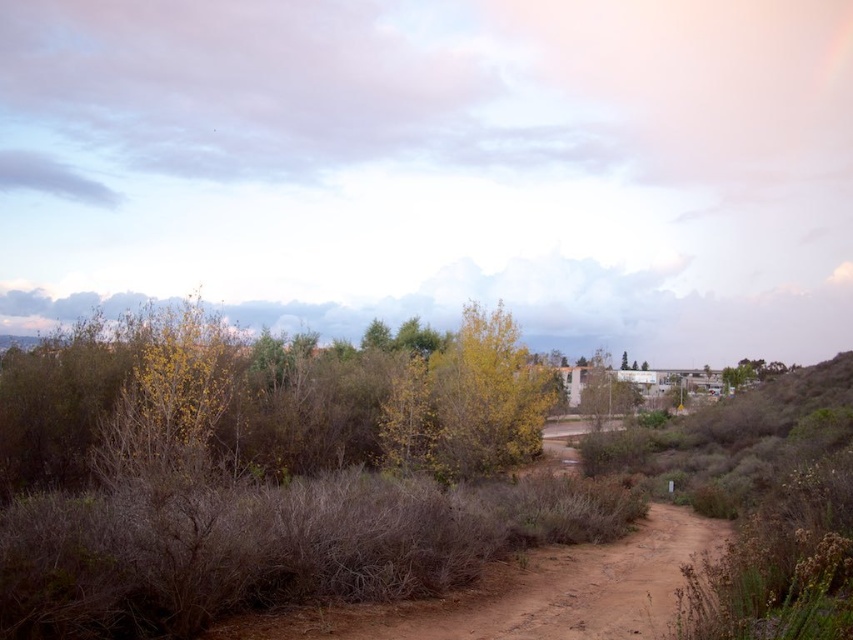
Is point (508, 460) positioned in front of point (751, 378)?

That is True.

Does green leafy bush at left have a larger size compared to green leafy tree at upper right?

Yes.

Who is more distant from viewer, (410,445) or (757,371)?

Positioned behind is point (757,371).

What are the coordinates of `green leafy bush at left` in the screenshot? It's located at (267, 401).

Is yellow-green leafy tree at center further to camera compared to green leafy tree at upper right?

That is False.

Does yellow-green leafy tree at center appear over green leafy tree at upper right?

Indeed, yellow-green leafy tree at center is positioned over green leafy tree at upper right.

Identify the location of yellow-green leafy tree at center. (486, 397).

Can you confirm if green leafy bush at left is wider than yellow-green leafy tree at center?

Yes, green leafy bush at left is wider than yellow-green leafy tree at center.

Can you confirm if green leafy bush at left is positioned to the right of yellow-green leafy tree at center?

In fact, green leafy bush at left is to the left of yellow-green leafy tree at center.

The image size is (853, 640). What do you see at coordinates (267, 401) in the screenshot?
I see `green leafy bush at left` at bounding box center [267, 401].

You are a GUI agent. You are given a task and a screenshot of the screen. Output one action in this format:
    pyautogui.click(x=<x>, y=<y>)
    Task: Click on the green leafy bush at left
    This screenshot has width=853, height=640.
    Given the screenshot: What is the action you would take?
    pyautogui.click(x=267, y=401)